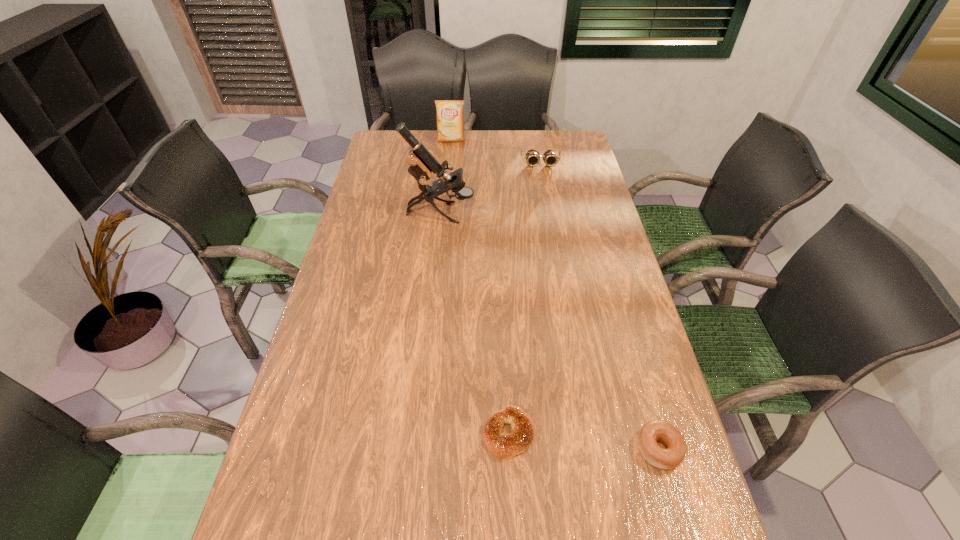
Identify the location of vacant region located 0.280m through the eyepiece of the third nearest object. (555, 213).

This screenshot has width=960, height=540. Find the location of `vacant space positioned 0.350m on the front-facing side of the farthest object`. vacant space positioned 0.350m on the front-facing side of the farthest object is located at coordinates (446, 193).

What are the coordinates of `free space located through the lenses of the fourth object from left to right` in the screenshot? It's located at 545,191.

Identify the location of vacant space situated 0.210m on the left of the right bagel. Image resolution: width=960 pixels, height=540 pixels. (540, 449).

Locate an element on the screen. This screenshot has width=960, height=540. vacant area situated 0.230m on the left of the shorter bagel is located at coordinates (380, 434).

Identify the location of crisp (potato chip) positioned at the far edge. The width and height of the screenshot is (960, 540). (450, 120).

Locate an element on the screen. This screenshot has width=960, height=540. goggles located in the far edge section of the desktop is located at coordinates (550, 158).

Locate an element on the screen. goggles positioned at the right edge is located at coordinates (550, 158).

This screenshot has height=540, width=960. Find the location of `bagel that is at the right edge`. bagel that is at the right edge is located at coordinates [x=654, y=431].

You are a GUI agent. You are given a task and a screenshot of the screen. Output one action in this format:
    pyautogui.click(x=<x>, y=<y>)
    Task: Click on the object that is at the far right corner
    The width and height of the screenshot is (960, 540).
    Given the screenshot: What is the action you would take?
    pyautogui.click(x=550, y=158)